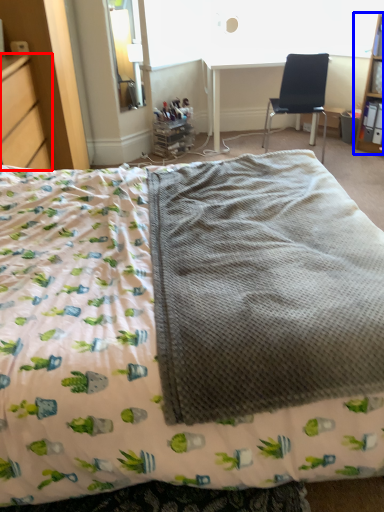
Question: Which object is closer to the camera taking this photo, file cabinet (highlighted by a red box) or shelf (highlighted by a blue box)?

Choices:
 (A) file cabinet
 (B) shelf

Answer: (A)